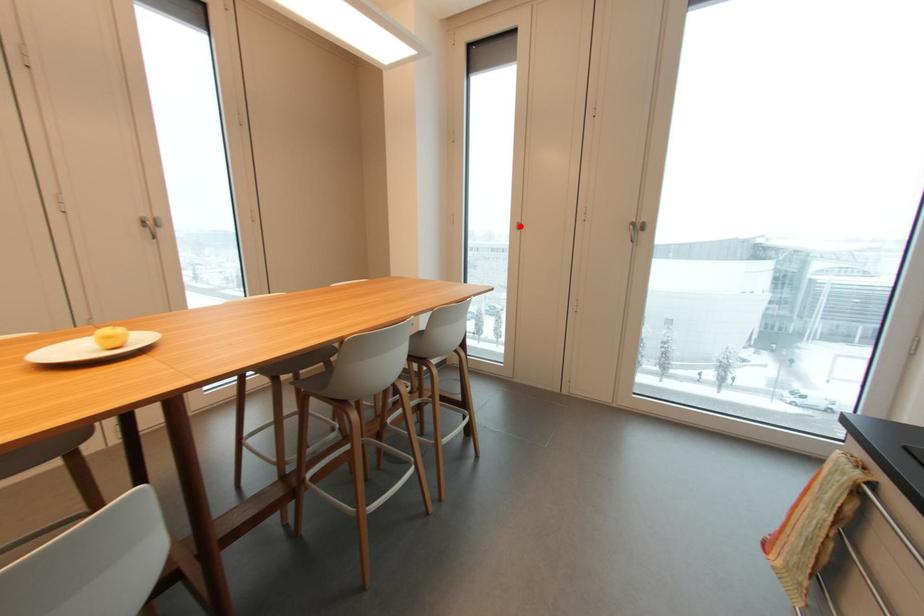
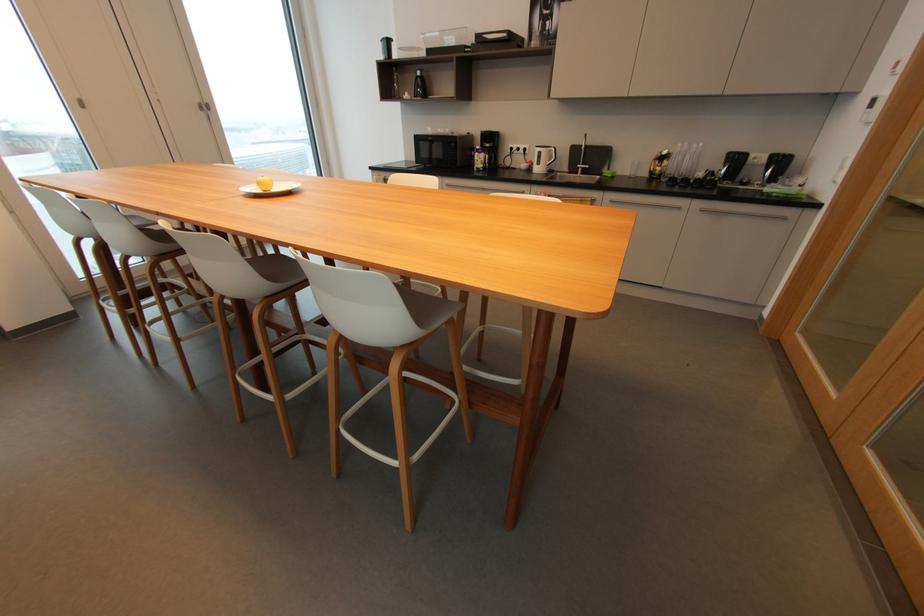
Question: A red point is marked in image1. In image2, is the corresponding 3D point closer to the camera or farther? Reply with the corresponding letter.

Choices:
 (A) The corresponding 3D point is closer.
 (B) The corresponding 3D point is farther.

Answer: (A)